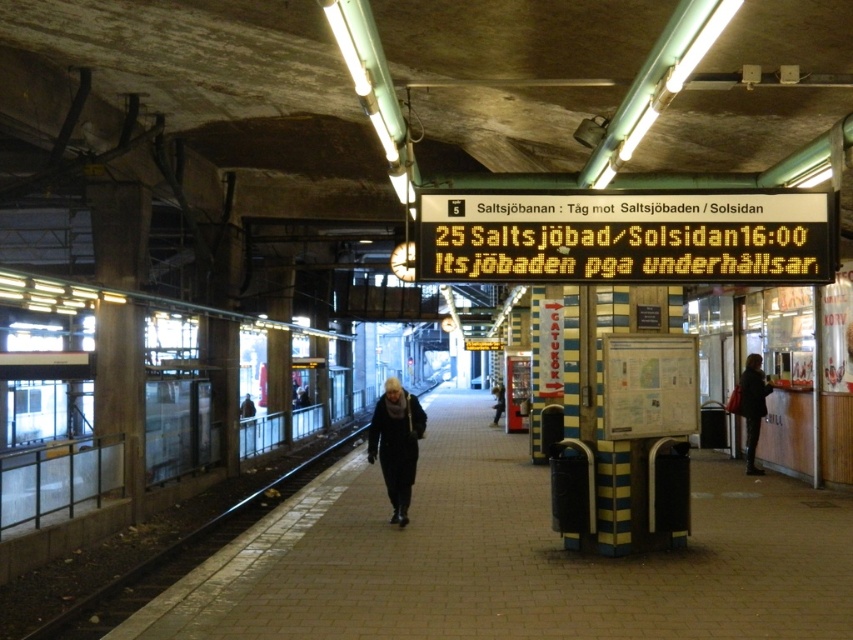
You are standing on the underground train station platform and want to check the train schedule. Where should you look to find the yellow digital display at center?

The yellow digital display at center is located at the 2D coordinates point (627, 237) on the platform.

You are standing on the subway platform and want to locate two points marked on the electronic display board. The first point is at coordinates point (714,218) and the second is at point (751,368). Which of these two points appears closer to you when looking at the display board?

Point (714,218) is closer to the viewer than point (751,368), so the first point appears closer when looking at the display board.

You are a commuter standing on the platform and want to check the schedule. The yellow digital display at center and the black metal train track at left are both in your view. Which object is nearer to you?

The yellow digital display at center is closer to you than the black metal train track at left.